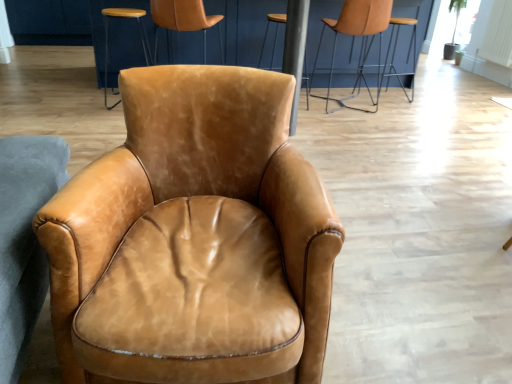
Question: Is brown leather bar stool at center situated inside light brown leather stool at upper center or outside?

Choices:
 (A) outside
 (B) inside

Answer: (A)

Question: Looking at their shapes, would you say brown leather bar stool at center is wider or thinner than light brown leather stool at upper center?

Choices:
 (A) wide
 (B) thin

Answer: (A)

Question: Estimate the real-world distances between objects in this image. Which object is farther from the brown leather bar stool at center?

Choices:
 (A) leather chair at upper center, positioned as the third chair in back-to-front order
 (B) leather armchair at upper right, arranged as the fourth chair when viewed from the front
 (C) light brown leather stool at upper center
 (D) saddle brown leather armchair at center, the first chair positioned from the front
 (E) leather tan chair at upper center, which appears as the 2th chair when viewed from the right

Answer: (D)

Question: Considering the real-world distances, which object is farthest from the leather tan chair at upper center, which appears as the 2th chair when viewed from the right?

Choices:
 (A) leather armchair at upper right, arranged as the fourth chair when viewed from the front
 (B) light brown leather stool at upper center
 (C) saddle brown leather armchair at center, the fourth chair viewed from the back
 (D) leather chair at upper center, which ranks as the 2th chair in front-to-back order
 (E) brown leather bar stool at center

Answer: (C)